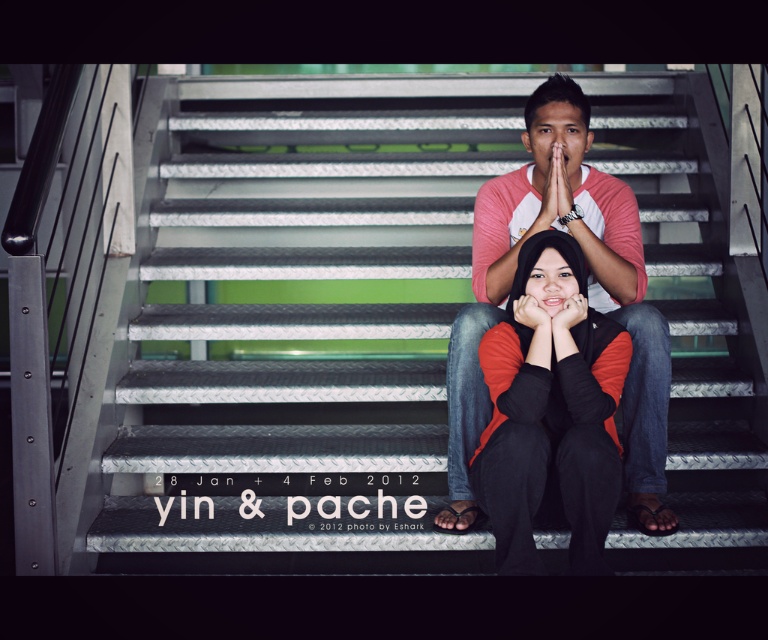
Question: Does matte pink shirt at center appear on the right side of matte orange sweater at center?

Choices:
 (A) yes
 (B) no

Answer: (A)

Question: Is metallic stairwell at center to the right of matte pink shirt at center from the viewer's perspective?

Choices:
 (A) no
 (B) yes

Answer: (A)

Question: Which of the following is the farthest from the observer?

Choices:
 (A) metallic stairwell at center
 (B) matte pink shirt at center
 (C) matte orange sweater at center

Answer: (A)

Question: Which of the following is the farthest from the observer?

Choices:
 (A) (558, 227)
 (B) (515, 397)

Answer: (A)

Question: Which point is farther to the camera?

Choices:
 (A) matte pink shirt at center
 (B) matte orange sweater at center
 (C) metallic stairwell at center

Answer: (C)

Question: Can you confirm if metallic stairwell at center is smaller than matte orange sweater at center?

Choices:
 (A) no
 (B) yes

Answer: (A)